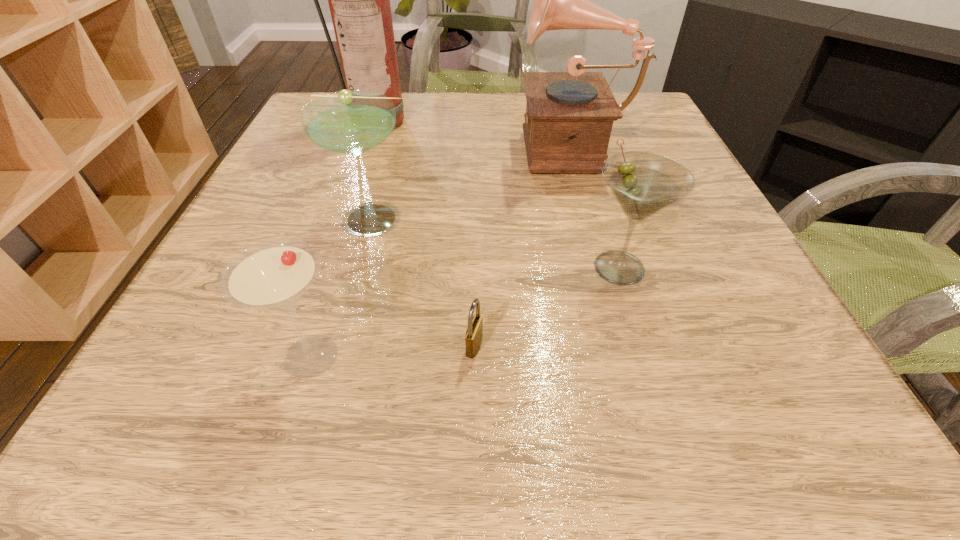
Locate which martini ranks in proximity to the second shortest object. Please provide its 2D coordinates. Your answer should be formatted as a tuple, i.e. [(x, y)], where the tuple contains the x and y coordinates of a point satisfying the conditions above.

[(350, 122)]

This screenshot has height=540, width=960. What are the coordinates of `martini object that ranks as the third closest to the padlock` in the screenshot? It's located at (350, 122).

The width and height of the screenshot is (960, 540). I want to click on free space that satisfies the following two spatial constraints: 1. on the side of the nearest martini with the label and nozzle; 2. on the right side of the fire extinguisher, so click(x=301, y=356).

Identify the location of vacant space that satisfies the following two spatial constraints: 1. on the side of the rightmost martini with the label and nozzle; 2. on the left side of the tallest object. The image size is (960, 540). (331, 267).

In order to click on vacant area in the image that satisfies the following two spatial constraints: 1. on the side of the rightmost martini with the label and nozzle; 2. on the left side of the fire extinguisher in this screenshot , I will do `click(331, 267)`.

Image resolution: width=960 pixels, height=540 pixels. Find the location of `vacant region that satisfies the following two spatial constraints: 1. on the back side of the fifth tallest object; 2. on the left side of the rightmost martini`. vacant region that satisfies the following two spatial constraints: 1. on the back side of the fifth tallest object; 2. on the left side of the rightmost martini is located at coordinates (339, 267).

Image resolution: width=960 pixels, height=540 pixels. In order to click on vacant area that satisfies the following two spatial constraints: 1. on the side of the rightmost martini with the label and nozzle; 2. on the left side of the tallest object in this screenshot , I will do `click(331, 267)`.